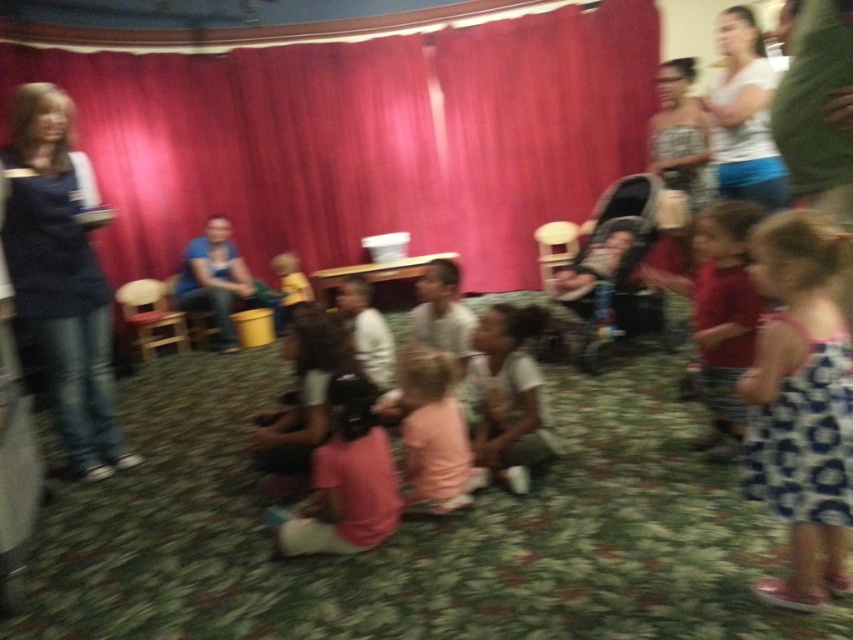
You are standing at the origin of the coordinate system in the room. You want to walk to the point at (x=146, y=173). However, there is an obstacle at point (x=67, y=176). Can you reach your destination without passing through the obstacle?

Point (x=146, y=173) is behind point (x=67, y=176), so you can reach it without passing through the obstacle.

You are organizing a small play and need to decide which fabric to use as the main backdrop. Given the scene described, which of the two fabrics, the red velvet curtain at upper center or the pink fabric at center, would be more suitable for covering a large stage area?

The red velvet curtain at upper center has a larger size compared to the pink fabric at center, making it more suitable for covering a large stage area.

In the scene shown: You are standing in the room and want to find the red velvet curtain at upper center. According to the scene description, where should you look in terms of direction?

The red velvet curtain at upper center is located at the upper center of the scene, so you should look towards the top middle area of the room.